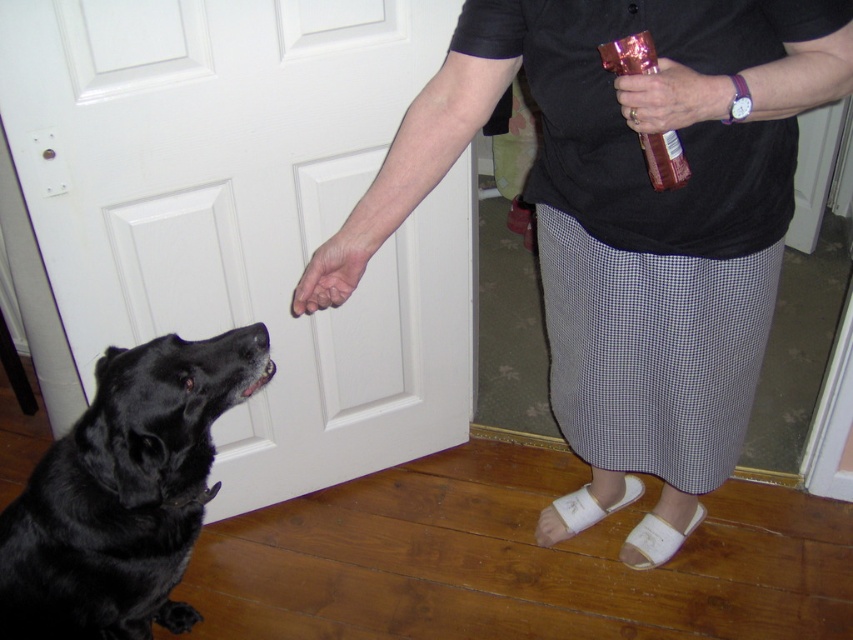
Question: Based on their relative distances, which object is farther from the metallic pink can at upper right?

Choices:
 (A) dry skin at center
 (B) black fur dog at left
 (C) matte black skirt at center
 (D) white matte door at center

Answer: (D)

Question: Which object is farther from the camera taking this photo?

Choices:
 (A) matte black skirt at center
 (B) white matte door at center
 (C) metallic pink can at upper right
 (D) dry skin at center

Answer: (B)

Question: Is matte black skirt at center to the left of dry skin at center from the viewer's perspective?

Choices:
 (A) yes
 (B) no

Answer: (B)

Question: Does black fur dog at left appear on the right side of metallic pink can at upper right?

Choices:
 (A) yes
 (B) no

Answer: (B)

Question: Which point is closer to the camera taking this photo?

Choices:
 (A) (724, 221)
 (B) (148, 605)
 (C) (364, 244)
 (D) (706, 93)

Answer: (D)

Question: Does white matte door at center have a larger size compared to dry skin at center?

Choices:
 (A) yes
 (B) no

Answer: (A)